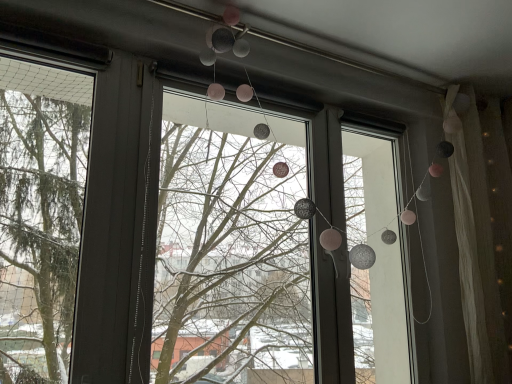
Question: From a real-world perspective, is translucent glass window at upper center on top of translucent white curtain at right?

Choices:
 (A) yes
 (B) no

Answer: (B)

Question: Considering the relative sizes of translucent glass window at upper center and translucent white curtain at right in the image provided, is translucent glass window at upper center bigger than translucent white curtain at right?

Choices:
 (A) no
 (B) yes

Answer: (B)

Question: Is translucent glass window at upper center completely or partially outside of translucent white curtain at right?

Choices:
 (A) yes
 (B) no

Answer: (A)

Question: Is translucent glass window at upper center facing towards translucent white curtain at right?

Choices:
 (A) no
 (B) yes

Answer: (A)

Question: Is translucent glass window at upper center closer to the viewer compared to translucent white curtain at right?

Choices:
 (A) no
 (B) yes

Answer: (B)

Question: Can you confirm if translucent glass window at upper center is taller than translucent white curtain at right?

Choices:
 (A) yes
 (B) no

Answer: (B)

Question: Is translucent white curtain at right wider than translucent glass window at upper center?

Choices:
 (A) yes
 (B) no

Answer: (A)

Question: Is translucent white curtain at right not close to translucent glass window at upper center?

Choices:
 (A) no
 (B) yes

Answer: (B)

Question: Does translucent white curtain at right have a larger size compared to translucent glass window at upper center?

Choices:
 (A) yes
 (B) no

Answer: (B)

Question: From a real-world perspective, is translucent white curtain at right beneath translucent glass window at upper center?

Choices:
 (A) yes
 (B) no

Answer: (B)

Question: Does translucent white curtain at right have a greater height compared to translucent glass window at upper center?

Choices:
 (A) yes
 (B) no

Answer: (A)

Question: Is translucent white curtain at right touching translucent glass window at upper center?

Choices:
 (A) no
 (B) yes

Answer: (A)

Question: From the image's perspective, relative to translucent glass window at upper center, is translucent white curtain at right above or below?

Choices:
 (A) below
 (B) above

Answer: (A)